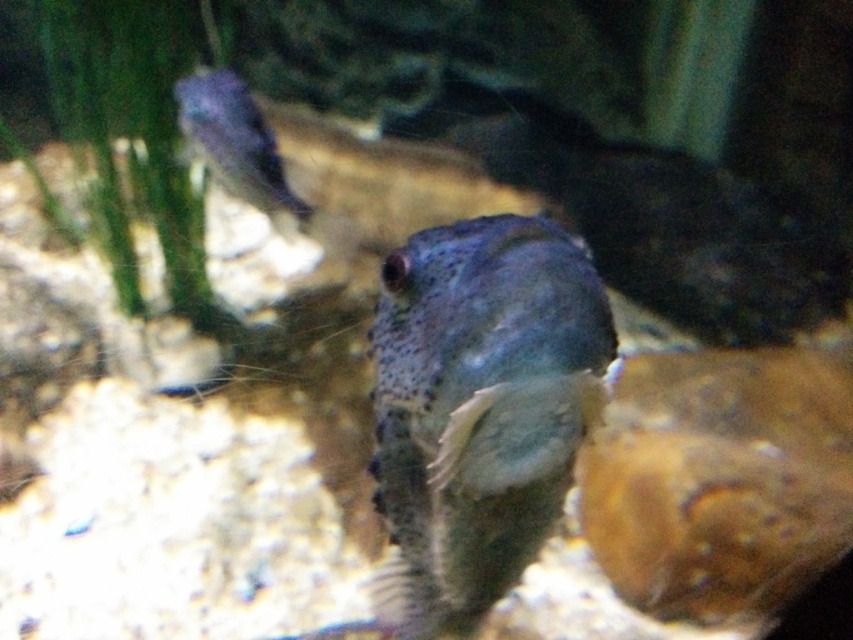
Which is below, speckled blue fish at center or translucent blue fish at upper left?

speckled blue fish at center is lower down.

How far apart are speckled blue fish at center and translucent blue fish at upper left?

speckled blue fish at center is 1.08 meters from translucent blue fish at upper left.

Describe the element at coordinates (479, 406) in the screenshot. I see `speckled blue fish at center` at that location.

You are a GUI agent. You are given a task and a screenshot of the screen. Output one action in this format:
    pyautogui.click(x=<x>, y=<y>)
    Task: Click on the speckled blue fish at center
    
    Given the screenshot: What is the action you would take?
    pyautogui.click(x=479, y=406)